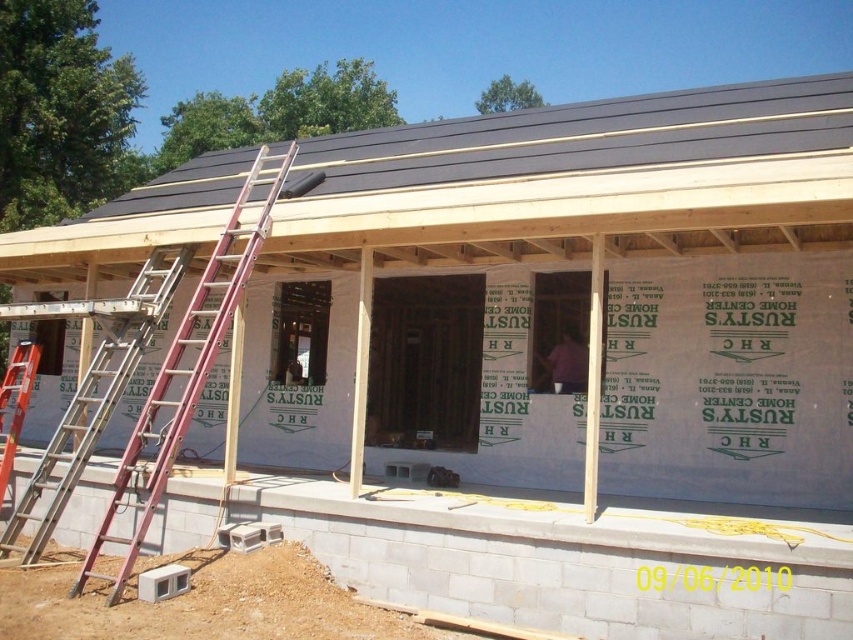
You are a construction worker standing at the base of the house. You need to reach the roof to inspect the shingles. Which ladder should you use, the silver metallic ladder at left or the orange metallic ladder at left, if the one closer to you is more accessible?

The silver metallic ladder at left is closer to the viewer than the orange metallic ladder at left, so you should use the silver metallic ladder at left as it is more accessible.

You are a construction worker standing at the base of the house. You need to reach both the white foam insulation at center and the dark gray shingles at upper center. Which object will require you to climb higher to reach?

The dark gray shingles at upper center will require climbing higher because they are located further away from the viewer compared to the white foam insulation at center, which is closer.

You are a construction worker standing at the entrance of the house under construction. You need to place a new tool at the same location as the white foam insulation at center. Where should you place it?

You should place the new tool at point (729, 380), which is the location of the white foam insulation at center.